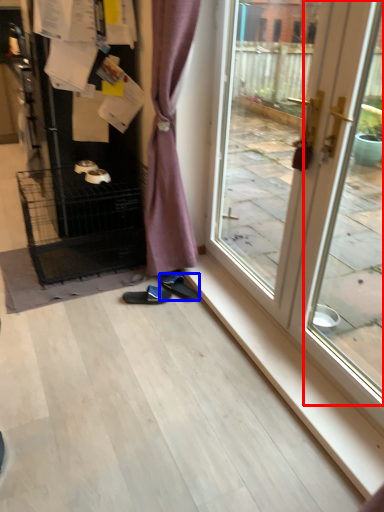
Question: Which of the following is the farthest to the observer, screen door (highlighted by a red box) or footwear (highlighted by a blue box)?

Choices:
 (A) screen door
 (B) footwear

Answer: (B)